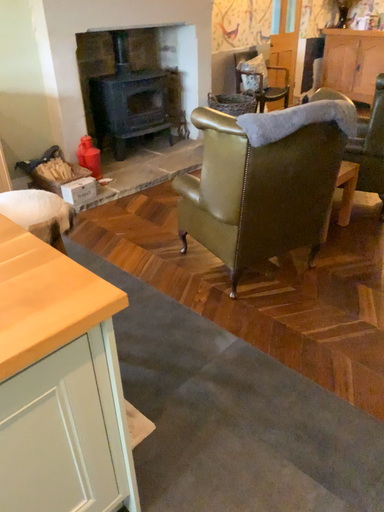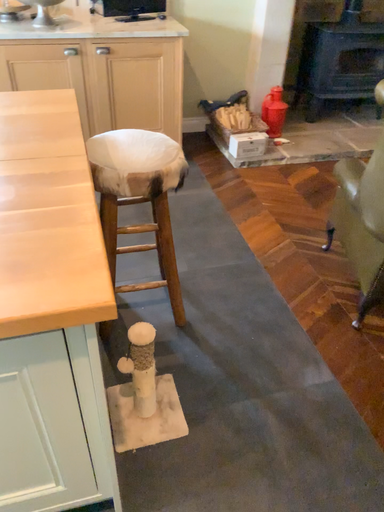
Question: How did the camera likely rotate when shooting the video?

Choices:
 (A) rotated left
 (B) rotated right

Answer: (A)